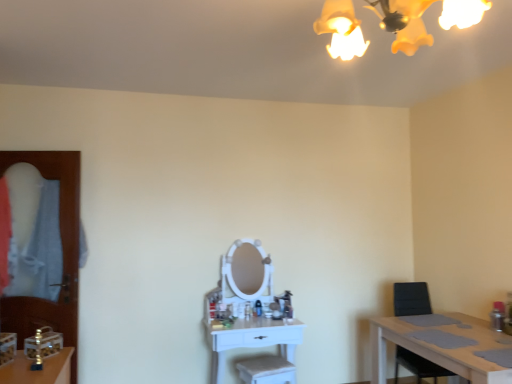
The width and height of the screenshot is (512, 384). What do you see at coordinates (442, 345) in the screenshot?
I see `light brown wooden table at lower right, the second table in the left-to-right sequence` at bounding box center [442, 345].

What is the approximate height of light brown wooden table at lower right, the second table in the left-to-right sequence?

light brown wooden table at lower right, the second table in the left-to-right sequence, is 23.35 inches tall.

Identify the location of transparent wooden door at left. (63, 255).

This screenshot has width=512, height=384. What are the coordinates of `white glossy vanity at center, the 1th table from the left` in the screenshot? It's located at (254, 340).

What are the coordinates of `black plastic chair at right` in the screenshot? It's located at (411, 299).

Is the depth of light brown wooden table at lower right, the second table in the left-to-right sequence, less than that of black plastic chair at right?

Yes, light brown wooden table at lower right, the second table in the left-to-right sequence, is closer to the camera.

Is light brown wooden table at lower right, acting as the 1th table starting from the right, turned away from black plastic chair at right?

No, light brown wooden table at lower right, acting as the 1th table starting from the right, is not facing away from black plastic chair at right.

In terms of height, does light brown wooden table at lower right, acting as the 1th table starting from the right, look taller or shorter compared to black plastic chair at right?

light brown wooden table at lower right, acting as the 1th table starting from the right, is shorter than black plastic chair at right.

Is light brown wooden table at lower right, acting as the 1th table starting from the right, not inside black plastic chair at right?

Absolutely, light brown wooden table at lower right, acting as the 1th table starting from the right, is external to black plastic chair at right.

Is point (277, 332) closer to viewer compared to point (408, 362)?

Yes.

How different are the orientations of white glossy vanity at center, placed as the 2th table when sorted from right to left, and black plastic chair at right in degrees?

The angle between the facing direction of white glossy vanity at center, placed as the 2th table when sorted from right to left, and the facing direction of black plastic chair at right is 4.94 degrees.

From a real-world perspective, which object stands above the other?

In real-world perspective, black plastic chair at right is above.

Is white glossy vanity at center, the 1th table from the left, located outside black plastic chair at right?

Absolutely, white glossy vanity at center, the 1th table from the left, is external to black plastic chair at right.

Is transparent wooden door at left at the back of yellow matte light fixture at upper center?

That's not correct — yellow matte light fixture at upper center is not looking away from transparent wooden door at left.

Is yellow matte light fixture at upper center not close to transparent wooden door at left?

Yes.

In the scene shown: From a real-world perspective, is yellow matte light fixture at upper center located beneath transparent wooden door at left?

Actually, yellow matte light fixture at upper center is physically above transparent wooden door at left in the real world.

Based on their sizes in the image, would you say white glossy vanity at center, placed as the 2th table when sorted from right to left, is bigger or smaller than transparent wooden door at left?

Considering their sizes, white glossy vanity at center, placed as the 2th table when sorted from right to left, takes up more space than transparent wooden door at left.

Between white glossy vanity at center, placed as the 2th table when sorted from right to left, and transparent wooden door at left, which one appears on the left side from the viewer's perspective?

Positioned to the left is transparent wooden door at left.

Is white glossy vanity at center, placed as the 2th table when sorted from right to left, not near transparent wooden door at left?

Absolutely, white glossy vanity at center, placed as the 2th table when sorted from right to left, is distant from transparent wooden door at left.

In terms of height, does black plastic chair at right look taller or shorter compared to yellow matte light fixture at upper center?

In the image, black plastic chair at right appears to be taller than yellow matte light fixture at upper center.

From the image's perspective, is black plastic chair at right on yellow matte light fixture at upper center?

No, from the image's perspective, black plastic chair at right is not on top of yellow matte light fixture at upper center.

Is black plastic chair at right positioned with its back to yellow matte light fixture at upper center?

No, black plastic chair at right is not facing away from yellow matte light fixture at upper center.

Looking at this image, is there a large distance between black plastic chair at right and yellow matte light fixture at upper center?

That's right, there is a large distance between black plastic chair at right and yellow matte light fixture at upper center.

Between point (412, 24) and point (258, 340), which one is positioned behind?

Positioned behind is point (258, 340).

Between yellow matte light fixture at upper center and white glossy vanity at center, placed as the 2th table when sorted from right to left, which one has less height?

Standing shorter between the two is yellow matte light fixture at upper center.

Does transparent wooden door at left lie in front of yellow matte light fixture at upper center?

No, it is behind yellow matte light fixture at upper center.

Which is closer to the camera, (69, 261) or (391, 0)?

Point (69, 261) appears to be farther away from the viewer than point (391, 0).

From a real-world perspective, is transparent wooden door at left located beneath yellow matte light fixture at upper center?

Yes, from a real-world perspective, transparent wooden door at left is below yellow matte light fixture at upper center.

What are the coordinates of `table in front of the black plastic chair at right` in the screenshot? It's located at (442, 345).

Identify the location of table lying behind the black plastic chair at right. This screenshot has height=384, width=512. (254, 340).

Which object lies further to the anchor point black plastic chair at right, yellow matte light fixture at upper center or white glossy vanity at center, the 1th table from the left?

Among the two, yellow matte light fixture at upper center is located further to black plastic chair at right.

Which object lies nearer to the anchor point light brown wooden table at lower right, the second table in the left-to-right sequence, white glossy vanity at center, placed as the 2th table when sorted from right to left, or transparent wooden door at left?

white glossy vanity at center, placed as the 2th table when sorted from right to left, lies closer to light brown wooden table at lower right, the second table in the left-to-right sequence, than the other object.

Which object lies nearer to the anchor point transparent wooden door at left, white glossy vanity at center, the 1th table from the left, or yellow matte light fixture at upper center?

Based on the image, white glossy vanity at center, the 1th table from the left, appears to be nearer to transparent wooden door at left.

When comparing their distances from yellow matte light fixture at upper center, does black plastic chair at right or white glossy vanity at center, placed as the 2th table when sorted from right to left, seem closer?

white glossy vanity at center, placed as the 2th table when sorted from right to left, is positioned closer to the anchor yellow matte light fixture at upper center.

Considering their positions, is light brown wooden table at lower right, acting as the 1th table starting from the right, positioned closer to yellow matte light fixture at upper center than transparent wooden door at left?

light brown wooden table at lower right, acting as the 1th table starting from the right, is closer to yellow matte light fixture at upper center.

Based on their spatial positions, is transparent wooden door at left or white glossy vanity at center, the 1th table from the left, further from light brown wooden table at lower right, acting as the 1th table starting from the right?

transparent wooden door at left.

When comparing their distances from black plastic chair at right, does white glossy vanity at center, placed as the 2th table when sorted from right to left, or transparent wooden door at left seem closer?

Based on the image, white glossy vanity at center, placed as the 2th table when sorted from right to left, appears to be nearer to black plastic chair at right.

From the image, which object appears to be farther from black plastic chair at right, yellow matte light fixture at upper center or light brown wooden table at lower right, the second table in the left-to-right sequence?

yellow matte light fixture at upper center is positioned further to the anchor black plastic chair at right.

Find the location of a particular element. Image resolution: width=512 pixels, height=384 pixels. table located between transparent wooden door at left and black plastic chair at right in the left-right direction is located at coordinates (254, 340).

Identify the location of armchair situated between transparent wooden door at left and light brown wooden table at lower right, the second table in the left-to-right sequence, from left to right. The image size is (512, 384). (411, 299).

Where is `table between yellow matte light fixture at upper center and white glossy vanity at center, the 1th table from the left, from top to bottom`? The image size is (512, 384). table between yellow matte light fixture at upper center and white glossy vanity at center, the 1th table from the left, from top to bottom is located at coordinates tap(442, 345).

Locate an element on the screen. light fixture between transparent wooden door at left and light brown wooden table at lower right, the second table in the left-to-right sequence, in the horizontal direction is located at coordinates (404, 23).